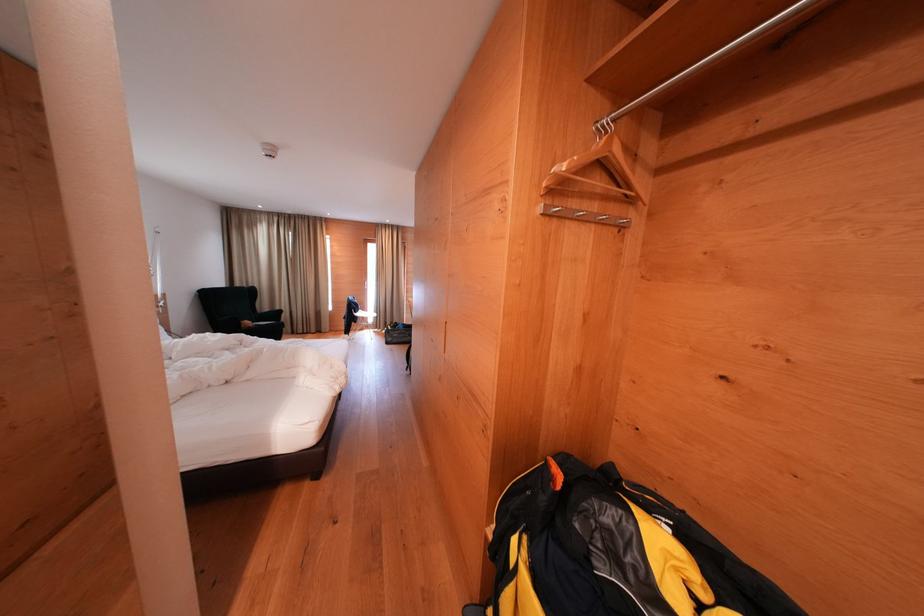
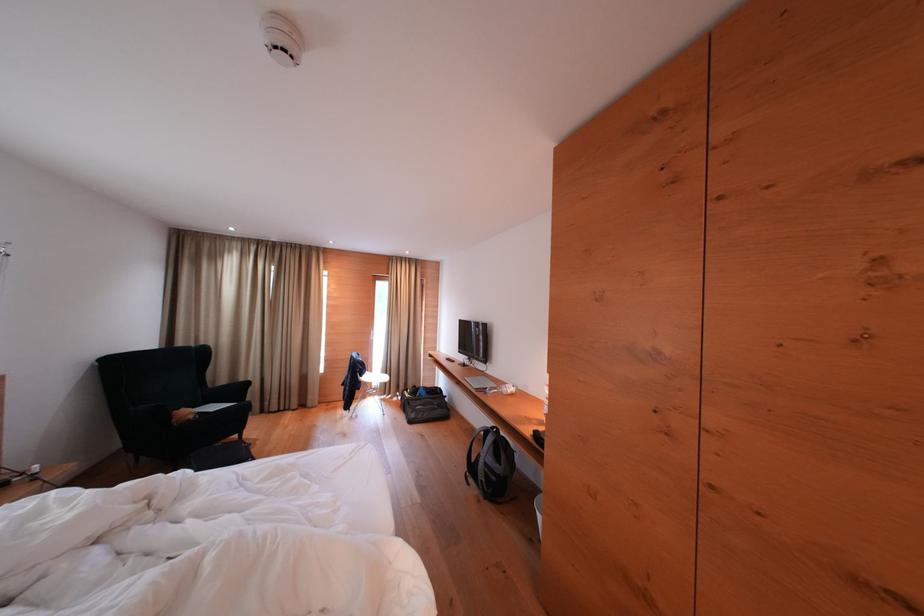
The images are taken continuously from a first-person perspective. In which direction are you moving?

The cameraman moved toward left, forward.